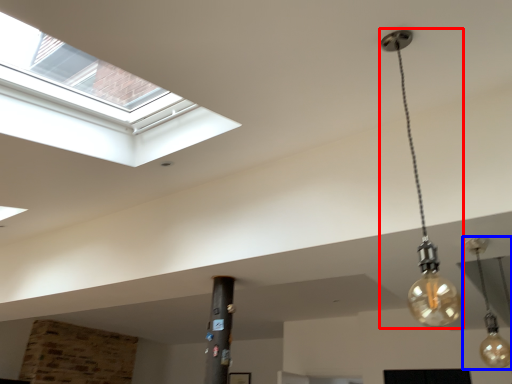
Question: Which of the following is the closest to the observer, lamp (highlighted by a red box) or lamp (highlighted by a blue box)?

Choices:
 (A) lamp
 (B) lamp

Answer: (A)